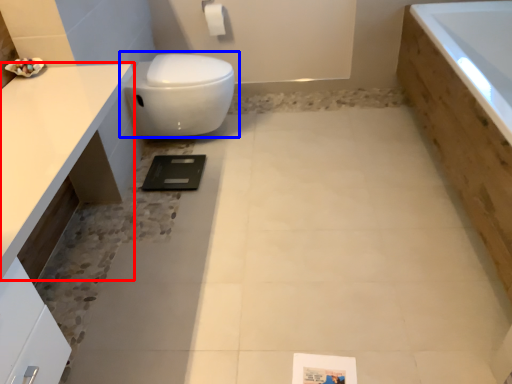
Question: Which object appears closest to the camera in this image, countertop (highlighted by a red box) or toilet (highlighted by a blue box)?

Choices:
 (A) countertop
 (B) toilet

Answer: (A)